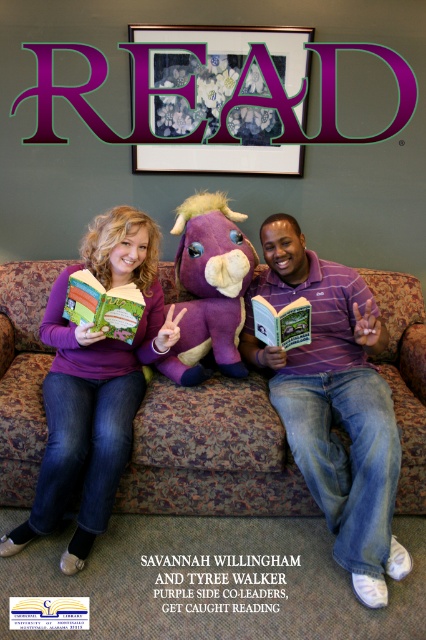
You are a delivery person who needs to place a small package between the purple soft sweater at center and the purple plush stuffed animal at center. Can you fit it there?

The purple soft sweater at center is 12.35 inches away from the purple plush stuffed animal at center, so yes, the small package can be placed between them as there is enough space.

You are a photographer who wants to take a picture of the scene. You need to know if the brown floral fabric couch at center is positioned to the right of the hardcover book at center to frame the shot correctly. Can you confirm this?

Yes, the brown floral fabric couch at center is to the right of the hardcover book at center, so you can frame the shot accordingly.